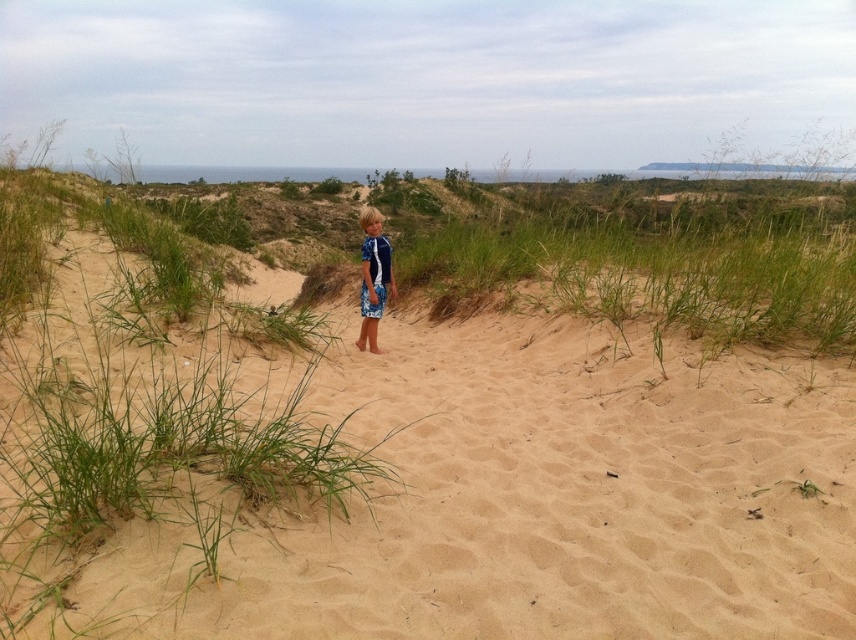
Where is `sandy tan sand at center`? Image resolution: width=856 pixels, height=640 pixels. sandy tan sand at center is located at coordinates (397, 464).

Does point (155, 346) lie behind point (372, 260)?

No, it is not.

Which is in front, point (281, 560) or point (366, 276)?

Point (281, 560) is more forward.

At what (x,y) coordinates should I click in order to perform the action: click on sandy tan sand at center. Please return your answer as a coordinate pair (x, y). This screenshot has width=856, height=640. Looking at the image, I should click on (397, 464).